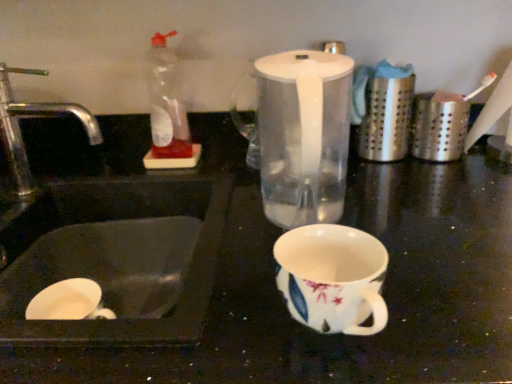
What is the approximate height of silver metallic faucet at left?

The height of silver metallic faucet at left is 10.15 inches.

Measure the distance between point (7, 81) and camera.

The distance of point (7, 81) from camera is 3.37 feet.

Find the location of a particular element. transparent plastic blender at center is located at coordinates (302, 135).

Considering the sizes of white glossy sink at lower left and transparent plastic blender at center in the image, is white glossy sink at lower left bigger or smaller than transparent plastic blender at center?

In the image, white glossy sink at lower left appears to be larger than transparent plastic blender at center.

Based on the photo, in terms of height, does white glossy sink at lower left look taller or shorter compared to transparent plastic blender at center?

white glossy sink at lower left is shorter than transparent plastic blender at center.

Looking at this image, measure the distance from white glossy sink at lower left to transparent plastic blender at center.

white glossy sink at lower left and transparent plastic blender at center are 28.82 centimeters apart from each other.

Is white glossy sink at lower left closer to camera compared to transparent plastic blender at center?

Yes, the depth of white glossy sink at lower left is less than that of transparent plastic blender at center.

This screenshot has width=512, height=384. I want to click on tap beneath the transparent plastic blender at center (from a real-world perspective), so click(33, 116).

Relative to transparent plastic blender at center, is silver metallic faucet at left in front or behind?

In the image, silver metallic faucet at left appears behind transparent plastic blender at center.

Is point (2, 107) positioned before point (273, 62)?

No, it is not.

From the image's perspective, which one is positioned higher, silver metallic faucet at left or white glossy sink at lower left?

From the image's view, silver metallic faucet at left is above.

The width and height of the screenshot is (512, 384). What are the coordinates of `tap above the white glossy sink at lower left (from the image's perspective)` in the screenshot? It's located at (33, 116).

In the scene shown: Is silver metallic faucet at left far from white glossy sink at lower left?

No, there isn't a large distance between silver metallic faucet at left and white glossy sink at lower left.

In the scene shown: Is there a large distance between transparent plastic blender at center and white glossy sink at lower left?

transparent plastic blender at center is near white glossy sink at lower left, not far away.

What's the angular difference between transparent plastic blender at center and white glossy sink at lower left's facing directions?

The angular difference between transparent plastic blender at center and white glossy sink at lower left is 2.56 degrees.

Considering the sizes of transparent plastic blender at center and white glossy sink at lower left in the image, is transparent plastic blender at center bigger or smaller than white glossy sink at lower left?

In the image, transparent plastic blender at center appears to be smaller than white glossy sink at lower left.

Visually, is transparent plastic blender at center positioned to the left or to the right of white glossy sink at lower left?

transparent plastic blender at center is to the right of white glossy sink at lower left.

From a real-world perspective, is transparent plastic blender at center physically above silver metallic faucet at left?

Correct, in the physical world, transparent plastic blender at center is higher than silver metallic faucet at left.

Consider the image. Between transparent plastic blender at center and silver metallic faucet at left, which one appears on the left side from the viewer's perspective?

From the viewer's perspective, silver metallic faucet at left appears more on the left side.

Does transparent plastic blender at center have a greater width compared to silver metallic faucet at left?

Indeed, transparent plastic blender at center has a greater width compared to silver metallic faucet at left.

This screenshot has height=384, width=512. Identify the location of tap below the transparent plastic blender at center (from a real-world perspective). (33, 116).

Can you confirm if white glossy sink at lower left is wider than silver metallic faucet at left?

Indeed, white glossy sink at lower left has a greater width compared to silver metallic faucet at left.

Is white glossy sink at lower left next to silver metallic faucet at left and touching it?

No, white glossy sink at lower left is not touching silver metallic faucet at left.

Considering the sizes of white glossy sink at lower left and silver metallic faucet at left in the image, is white glossy sink at lower left taller or shorter than silver metallic faucet at left?

white glossy sink at lower left is shorter than silver metallic faucet at left.

This screenshot has height=384, width=512. Identify the location of sink in front of the transparent plastic blender at center. (105, 227).

The width and height of the screenshot is (512, 384). I want to click on blender on the right side of silver metallic faucet at left, so click(x=302, y=135).

Based on the photo, which object lies further to the anchor point white glossy sink at lower left, silver metallic faucet at left or transparent plastic blender at center?

Based on the image, transparent plastic blender at center appears to be further to white glossy sink at lower left.

From the image, which object appears to be nearer to silver metallic faucet at left, transparent plastic blender at center or white glossy sink at lower left?

white glossy sink at lower left is positioned closer to the anchor silver metallic faucet at left.

Estimate the real-world distances between objects in this image. Which object is further from transparent plastic blender at center, silver metallic faucet at left or white glossy sink at lower left?

silver metallic faucet at left is further to transparent plastic blender at center.

Which object lies nearer to the anchor point white glossy sink at lower left, transparent plastic blender at center or silver metallic faucet at left?

silver metallic faucet at left is closer to white glossy sink at lower left.

Which object lies further to the anchor point silver metallic faucet at left, white glossy sink at lower left or transparent plastic blender at center?

Among the two, transparent plastic blender at center is located further to silver metallic faucet at left.

From the image, which object appears to be nearer to transparent plastic blender at center, white glossy sink at lower left or silver metallic faucet at left?

white glossy sink at lower left.

Where is `sink between silver metallic faucet at left and transparent plastic blender at center in the horizontal direction`? Image resolution: width=512 pixels, height=384 pixels. sink between silver metallic faucet at left and transparent plastic blender at center in the horizontal direction is located at coordinates (105, 227).